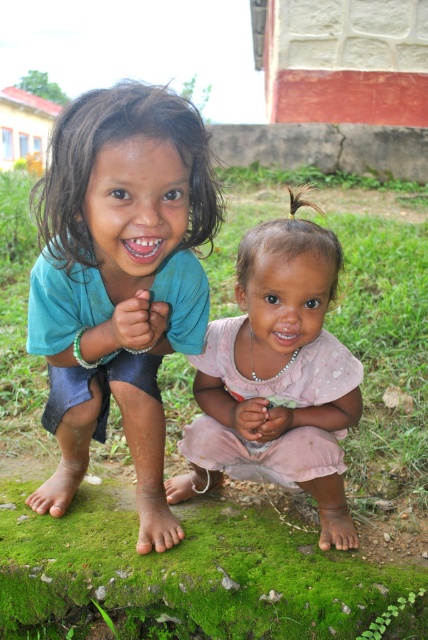
Is blue fabric shirt at left to the left of pink fabric dress at center from the viewer's perspective?

Indeed, blue fabric shirt at left is positioned on the left side of pink fabric dress at center.

Is blue fabric shirt at left shorter than pink fabric dress at center?

No.

Does point (56, 336) lie in front of point (208, 340)?

Yes.

The width and height of the screenshot is (428, 640). I want to click on blue fabric shirt at left, so click(119, 280).